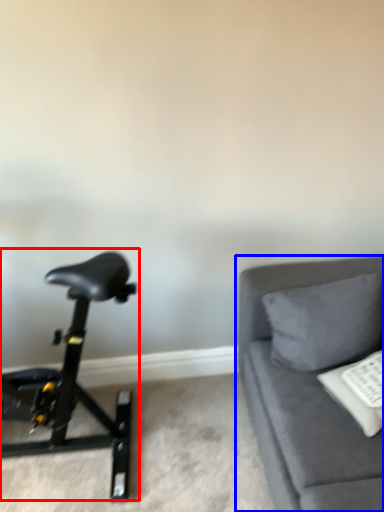
Question: Which of the following is the farthest to the observer, stationary bicycle (highlighted by a red box) or studio couch (highlighted by a blue box)?

Choices:
 (A) stationary bicycle
 (B) studio couch

Answer: (A)